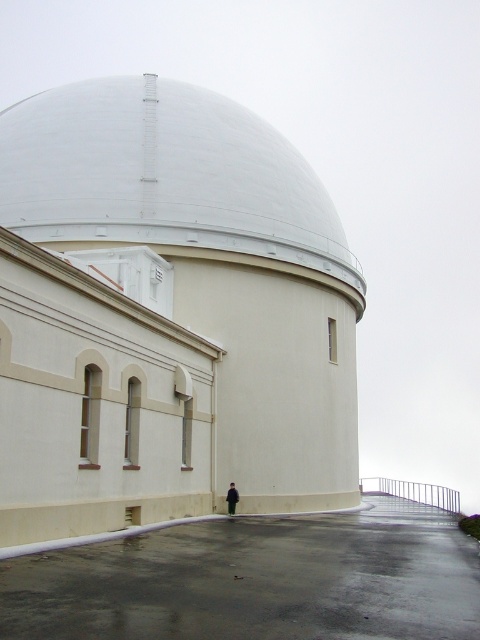
Who is positioned more to the right, white smooth dome at center or black matte jacket at lower center?

black matte jacket at lower center is more to the right.

Can you confirm if white smooth dome at center is positioned above black matte jacket at lower center?

Yes, white smooth dome at center is above black matte jacket at lower center.

The width and height of the screenshot is (480, 640). What are the coordinates of `white smooth dome at center` in the screenshot? It's located at (167, 177).

Locate an element on the screen. The width and height of the screenshot is (480, 640). white smooth dome at center is located at coordinates (167, 177).